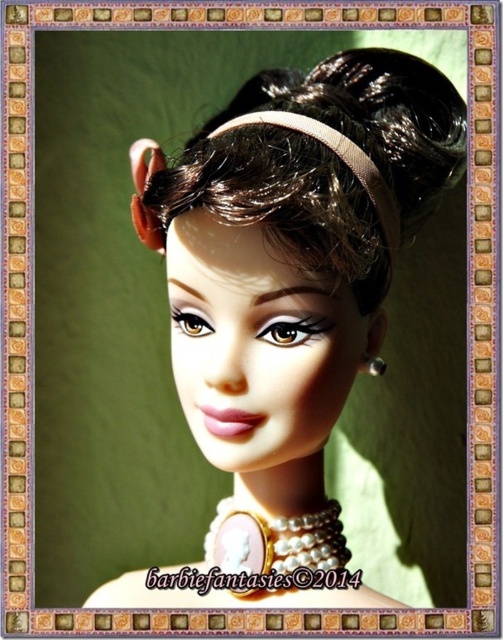
Question: Can you confirm if matte plastic doll at center is positioned above silver metallic earring at upper center?

Choices:
 (A) yes
 (B) no

Answer: (A)

Question: Is matte plastic doll at center to the right of silver metallic earring at upper center from the viewer's perspective?

Choices:
 (A) yes
 (B) no

Answer: (B)

Question: Which of the following is the farthest from the observer?

Choices:
 (A) silver metallic earring at upper center
 (B) brown matte headband at upper center
 (C) matte plastic doll at center

Answer: (A)

Question: Estimate the real-world distances between objects in this image. Which object is farther from the silver metallic earring at upper center?

Choices:
 (A) matte plastic doll at center
 (B) brown matte headband at upper center

Answer: (B)

Question: Does brown matte headband at upper center lie behind silver metallic earring at upper center?

Choices:
 (A) no
 (B) yes

Answer: (A)

Question: Which is farther from the matte plastic doll at center?

Choices:
 (A) silver metallic earring at upper center
 (B) brown matte headband at upper center

Answer: (A)